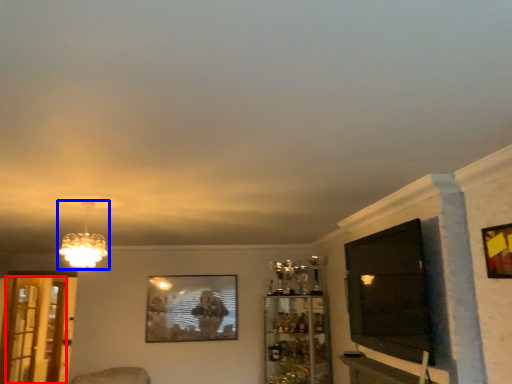
Question: Which object is further to the camera taking this photo, screen door (highlighted by a red box) or lamp (highlighted by a blue box)?

Choices:
 (A) screen door
 (B) lamp

Answer: (A)